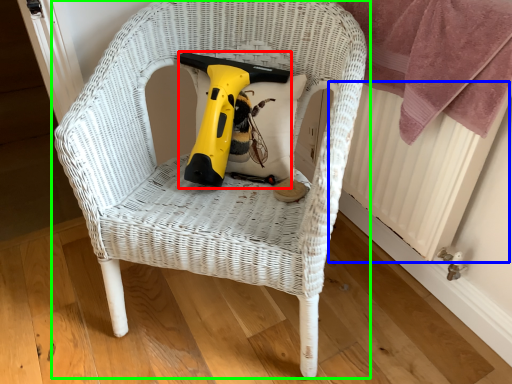
Question: Based on their relative distances, which object is nearer to electric drill (highlighted by a red box)? Choose from radiator (highlighted by a blue box) and chair (highlighted by a green box).

Choices:
 (A) radiator
 (B) chair

Answer: (B)